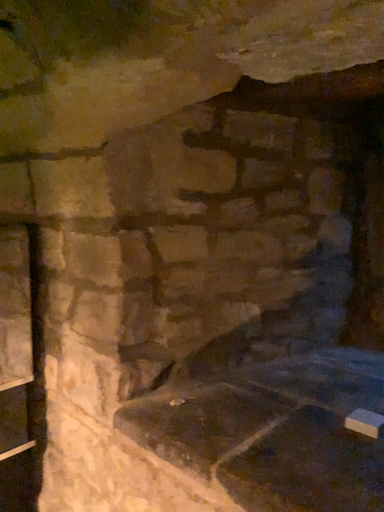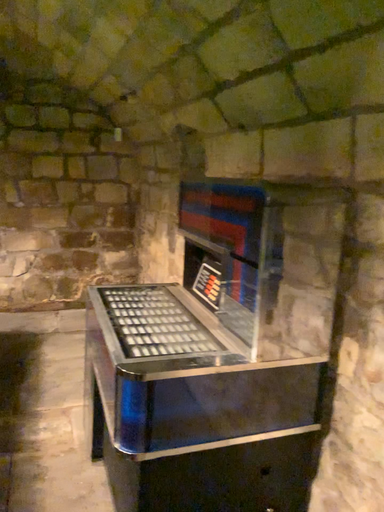
Question: Which way did the camera rotate in the video?

Choices:
 (A) rotated left
 (B) rotated right

Answer: (A)